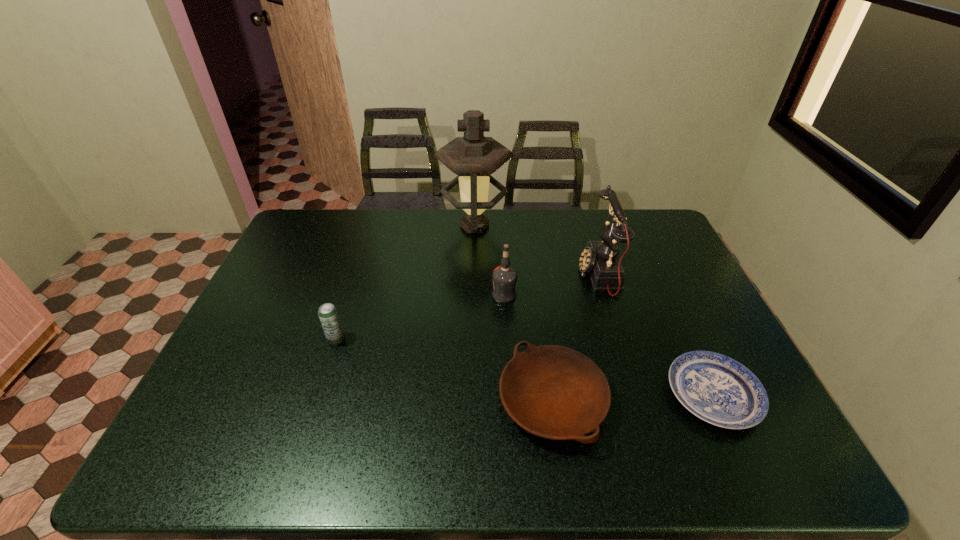
You are a GUI agent. You are given a task and a screenshot of the screen. Output one action in this format:
    pyautogui.click(x=<x>, y=<y>)
    Task: Click on the vacant space at the far right corner of the desktop
    
    Given the screenshot: What is the action you would take?
    pyautogui.click(x=645, y=218)

The image size is (960, 540). Find the location of `free space between the oil lamp and the telephone`. free space between the oil lamp and the telephone is located at coordinates (537, 250).

Where is `free space that is in between the fifth object from left to right and the shortest object`? Image resolution: width=960 pixels, height=540 pixels. free space that is in between the fifth object from left to right and the shortest object is located at coordinates (657, 335).

You are a GUI agent. You are given a task and a screenshot of the screen. Output one action in this format:
    pyautogui.click(x=<x>, y=<y>)
    Task: Click on the blank region between the vodka and the shorter plate
    The width and height of the screenshot is (960, 540).
    Given the screenshot: What is the action you would take?
    pyautogui.click(x=609, y=345)

Where is `vacant space that is in between the fifth object from left to right and the third nearest object`? vacant space that is in between the fifth object from left to right and the third nearest object is located at coordinates (468, 307).

What are the coordinates of `empty space between the fourth shortest object and the beer can` in the screenshot? It's located at (420, 317).

Image resolution: width=960 pixels, height=540 pixels. I want to click on unoccupied position between the rightmost object and the tallest object, so click(x=594, y=310).

Locate an element on the screen. The height and width of the screenshot is (540, 960). free space between the second object from right to left and the third tallest object is located at coordinates (552, 285).

I want to click on free space between the farthest object and the taller plate, so click(514, 313).

This screenshot has width=960, height=540. What are the coordinates of `free space between the rightmost object and the tallest object` in the screenshot? It's located at 594,310.